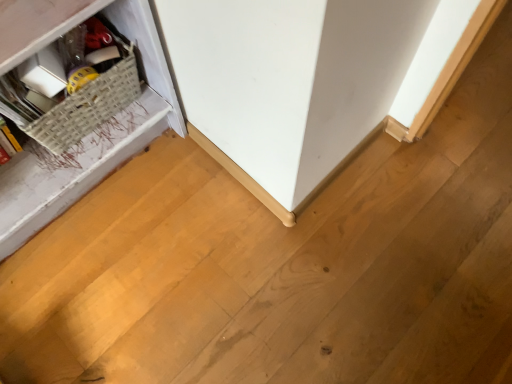
Locate an element on the screen. This screenshot has width=512, height=384. vacant point above woven beige basket at left (from a real-world perspective) is located at coordinates (73, 68).